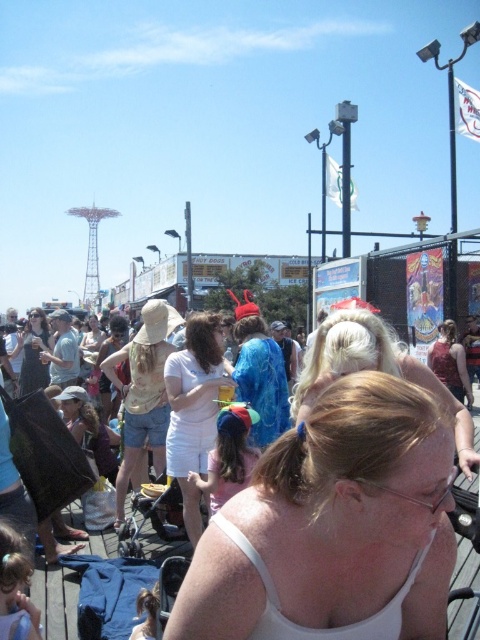
Question: Which object is positioned closest to the blue sequined dress at center?

Choices:
 (A) white cotton shirt at center
 (B) beige straw hat at center

Answer: (A)

Question: Can you confirm if blonde hair at center is positioned below beige straw hat at center?

Choices:
 (A) no
 (B) yes

Answer: (A)

Question: Where is white fabric at center located in relation to matte red tank top at right in the image?

Choices:
 (A) right
 (B) left

Answer: (B)

Question: From the image, what is the correct spatial relationship of white cotton dress at center in relation to blue sequined dress at center?

Choices:
 (A) right
 (B) left

Answer: (B)

Question: Which point is farther to the camera?

Choices:
 (A) (277, 385)
 (B) (27, 390)
 (C) (379, 428)
 (D) (171, 397)

Answer: (B)

Question: Which point is farther to the camera?

Choices:
 (A) (441, 362)
 (B) (39, 365)
 (C) (251, 435)
 (D) (385, 429)

Answer: (B)